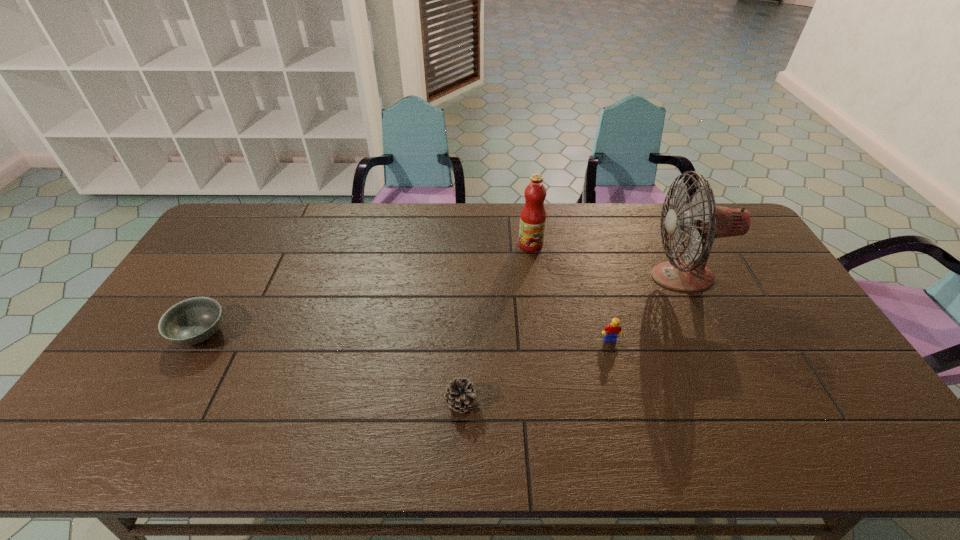
You are a GUI agent. You are given a task and a screenshot of the screen. Output one action in this format:
    pyautogui.click(x=<x>, y=<y>)
    Task: Click on the fan
    This screenshot has width=960, height=540.
    Given the screenshot: What is the action you would take?
    pyautogui.click(x=705, y=220)

Locate an element on the screen. This screenshot has height=540, width=960. the rightmost object is located at coordinates (705, 220).

The width and height of the screenshot is (960, 540). In order to click on fruit juice in this screenshot , I will do `click(533, 215)`.

The image size is (960, 540). In order to click on the second tallest object in this screenshot , I will do `click(533, 215)`.

You are a GUI agent. You are given a task and a screenshot of the screen. Output one action in this format:
    pyautogui.click(x=<x>, y=<y>)
    Task: Click on the fourth object from left to right
    
    Given the screenshot: What is the action you would take?
    pyautogui.click(x=613, y=329)

Find the location of `the second object from left to right`. the second object from left to right is located at coordinates (461, 395).

Where is `the nearest object`? This screenshot has width=960, height=540. the nearest object is located at coordinates (461, 395).

The width and height of the screenshot is (960, 540). In order to click on the leftmost object in this screenshot , I will do `click(192, 321)`.

Locate an element on the screen. The width and height of the screenshot is (960, 540). free space located in front of the fan to direct airflow is located at coordinates (549, 276).

Find the location of a particular element. This screenshot has height=540, width=960. vacant region located in front of the fan to direct airflow is located at coordinates (556, 276).